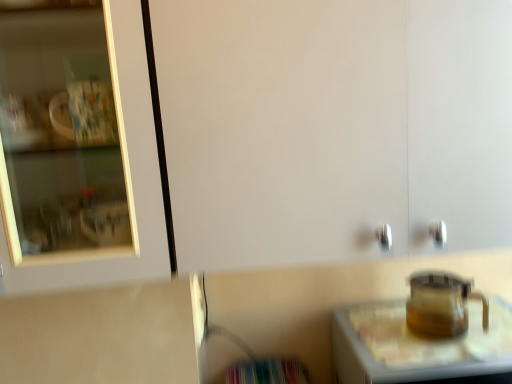
Question: From the image's perspective, relative to transparent glass teapot at lower right, is transparent glass table at lower right above or below?

Choices:
 (A) below
 (B) above

Answer: (A)

Question: Is transparent glass table at lower right bigger or smaller than transparent glass teapot at lower right?

Choices:
 (A) small
 (B) big

Answer: (B)

Question: Visually, is transparent glass table at lower right positioned to the left or to the right of transparent glass teapot at lower right?

Choices:
 (A) right
 (B) left

Answer: (A)

Question: Considering the positions of transparent glass teapot at lower right and transparent glass table at lower right in the image, is transparent glass teapot at lower right taller or shorter than transparent glass table at lower right?

Choices:
 (A) short
 (B) tall

Answer: (A)

Question: Looking at the image, does transparent glass teapot at lower right seem bigger or smaller compared to transparent glass table at lower right?

Choices:
 (A) big
 (B) small

Answer: (B)

Question: From a real-world perspective, is transparent glass teapot at lower right positioned above or below transparent glass table at lower right?

Choices:
 (A) above
 (B) below

Answer: (A)

Question: Choose the correct answer: Is transparent glass teapot at lower right inside transparent glass table at lower right or outside it?

Choices:
 (A) inside
 (B) outside

Answer: (B)